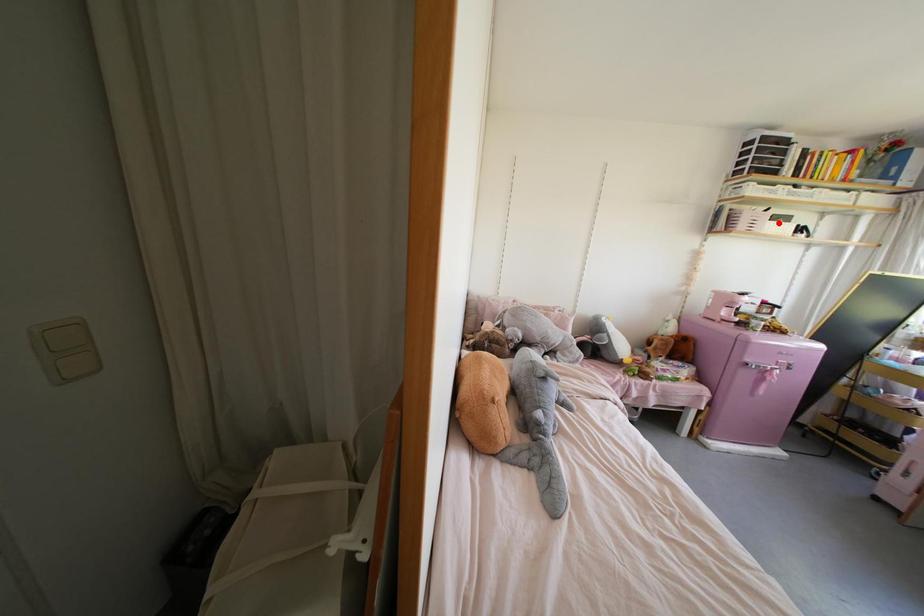
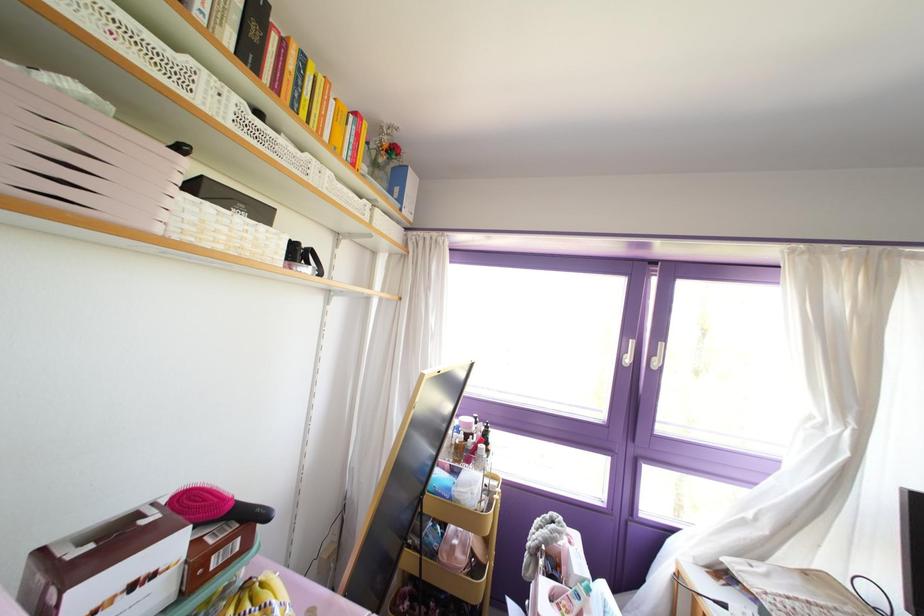
Find the pixel in the second image that matches the highlighted location in the first image.

(237, 219)